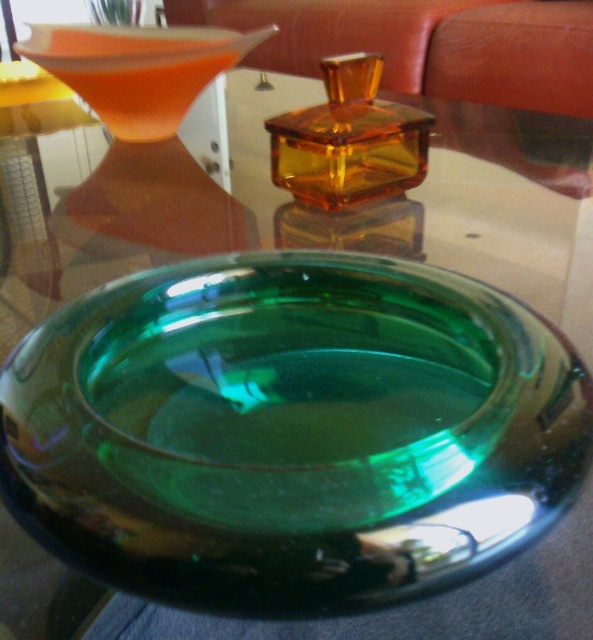
Question: Which of the following is the farthest from the observer?

Choices:
 (A) translucent amber glass at upper left
 (B) amber glass perfume at center

Answer: (B)

Question: Is translucent amber glass at upper left thinner than amber glass perfume at center?

Choices:
 (A) yes
 (B) no

Answer: (B)

Question: Can you confirm if translucent amber glass at upper left is positioned to the right of amber glass perfume at center?

Choices:
 (A) yes
 (B) no

Answer: (B)

Question: Is translucent amber glass at upper left smaller than amber glass perfume at center?

Choices:
 (A) no
 (B) yes

Answer: (A)